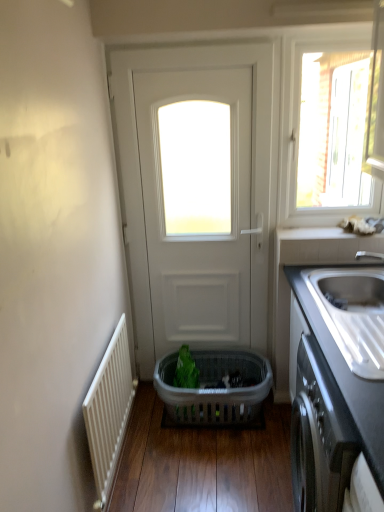
Question: Can you confirm if white matte door at center is smaller than satin steel sink at right?

Choices:
 (A) yes
 (B) no

Answer: (B)

Question: Considering the relative positions of white matte door at center and satin steel sink at right in the image provided, is white matte door at center behind satin steel sink at right?

Choices:
 (A) yes
 (B) no

Answer: (A)

Question: From a real-world perspective, is white matte door at center physically above satin steel sink at right?

Choices:
 (A) no
 (B) yes

Answer: (B)

Question: From the image's perspective, would you say white matte door at center is shown under satin steel sink at right?

Choices:
 (A) yes
 (B) no

Answer: (B)

Question: Would you say white matte door at center is a long distance from satin steel sink at right?

Choices:
 (A) yes
 (B) no

Answer: (B)

Question: Is white matte door at center thinner than satin steel sink at right?

Choices:
 (A) yes
 (B) no

Answer: (A)

Question: From the image's perspective, would you say green plastic basket at center is positioned over white ribbed radiator at left?

Choices:
 (A) yes
 (B) no

Answer: (A)

Question: Considering the relative positions of green plastic basket at center and white ribbed radiator at left in the image provided, is green plastic basket at center to the left of white ribbed radiator at left from the viewer's perspective?

Choices:
 (A) yes
 (B) no

Answer: (B)

Question: Can you confirm if green plastic basket at center is thinner than white ribbed radiator at left?

Choices:
 (A) yes
 (B) no

Answer: (B)

Question: Would you say green plastic basket at center is outside white ribbed radiator at left?

Choices:
 (A) yes
 (B) no

Answer: (A)

Question: From a real-world perspective, is green plastic basket at center over white ribbed radiator at left?

Choices:
 (A) yes
 (B) no

Answer: (B)

Question: Does green plastic basket at center lie in front of white ribbed radiator at left?

Choices:
 (A) no
 (B) yes

Answer: (A)

Question: From the image's perspective, is black matte cabinet at lower right below transparent glass window at upper right?

Choices:
 (A) yes
 (B) no

Answer: (A)